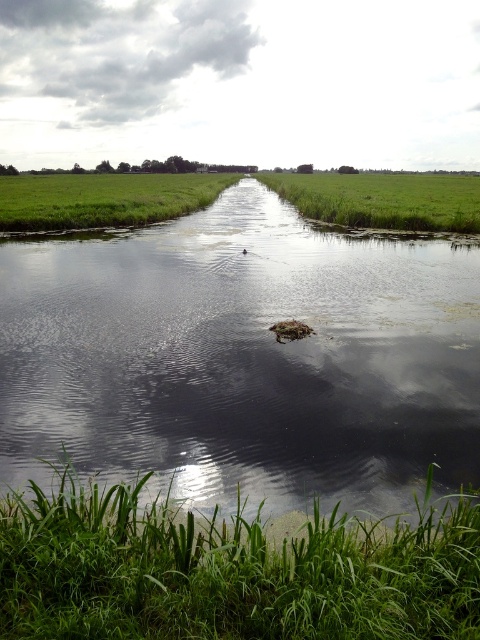
Does green leafy grass at center have a greater height compared to green grass at left?

Incorrect, green leafy grass at center's height is not larger of green grass at left's.

Which of these two, green leafy grass at center or green grass at left, stands shorter?

green leafy grass at center

Locate an element on the screen. The width and height of the screenshot is (480, 640). green leafy grass at center is located at coordinates (229, 570).

Is clear water at center to the right of green grass at left from the viewer's perspective?

Indeed, clear water at center is positioned on the right side of green grass at left.

Can you confirm if clear water at center is positioned below green grass at left?

Correct, clear water at center is located below green grass at left.

Between point (210, 317) and point (123, 205), which one is positioned in front?

Point (210, 317) is more forward.

At what (x,y) coordinates should I click in order to perform the action: click on clear water at center. Please return your answer as a coordinate pair (x, y). The width and height of the screenshot is (480, 640). Looking at the image, I should click on (242, 360).

Is point (31, 403) more distant than point (460, 228)?

No, (31, 403) is closer to viewer.

Is point (396, 502) positioned in front of point (313, 218)?

Yes, point (396, 502) is in front of point (313, 218).

In order to click on clear water at center in this screenshot , I will do `click(242, 360)`.